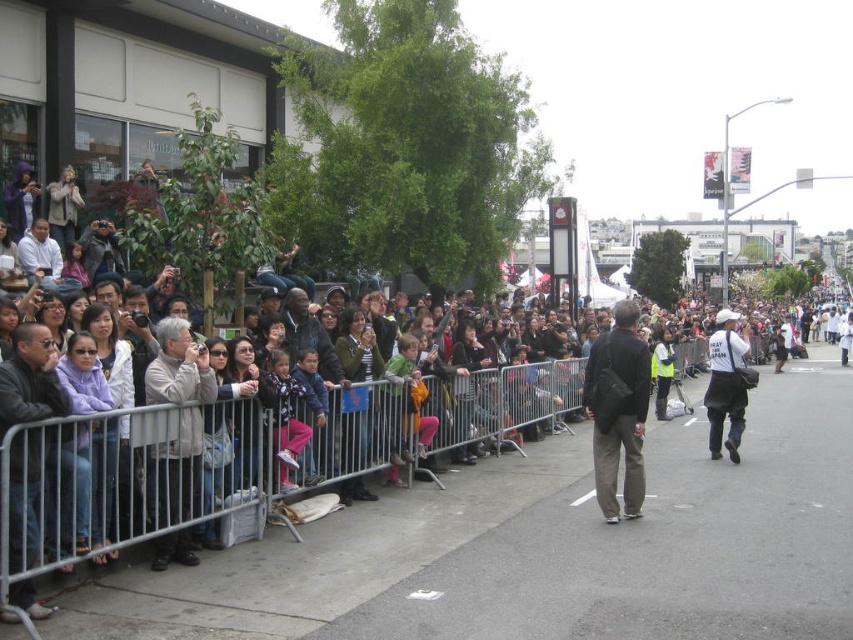
In order to click on matte black jacket at upper left in this screenshot , I will do `click(177, 438)`.

Does matte black jacket at upper left appear over white matte vest at center?

No, matte black jacket at upper left is not above white matte vest at center.

Is point (467, 385) closer to viewer compared to point (726, 339)?

No, (467, 385) is behind (726, 339).

This screenshot has height=640, width=853. In order to click on matte black jacket at upper left in this screenshot , I will do `click(177, 438)`.

I want to click on dark gray jacket at left, so click(x=30, y=380).

Is dark gray jacket at left to the left of dark gray fabric jacket at center from the viewer's perspective?

Indeed, dark gray jacket at left is positioned on the left side of dark gray fabric jacket at center.

Looking at this image, who is more distant from viewer, (47, 381) or (624, 412)?

Point (624, 412)

The height and width of the screenshot is (640, 853). I want to click on dark gray jacket at left, so click(x=30, y=380).

Between white matte vest at center and white matte shirt at left, which one is positioned higher?

white matte shirt at left

Does white matte vest at center appear on the right side of white matte shirt at left?

Yes, white matte vest at center is to the right of white matte shirt at left.

Who is more forward, (720, 358) or (41, 259)?

Point (41, 259)

This screenshot has width=853, height=640. In order to click on white matte vest at center in this screenshot , I will do `click(724, 385)`.